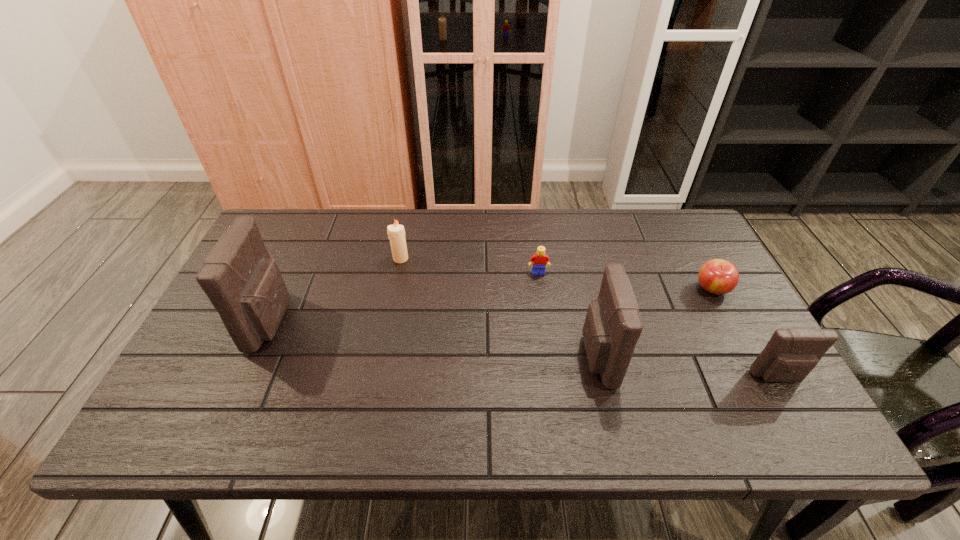
At what (x,y) coordinates should I click in order to perform the action: click on object that is positioned at the near right corner. Please return your answer as a coordinate pair (x, y). Looking at the image, I should click on (791, 354).

In the image, there is a desktop. Where is `vacant space at the far edge`? Image resolution: width=960 pixels, height=540 pixels. vacant space at the far edge is located at coordinates (538, 244).

I want to click on free space at the near edge of the desktop, so click(694, 393).

In the image, there is a desktop. Where is `vacant space at the left edge`? The height and width of the screenshot is (540, 960). vacant space at the left edge is located at coordinates (207, 366).

The width and height of the screenshot is (960, 540). Identify the location of free space at the right edge of the desktop. (696, 287).

Find the location of `blank area at the far right corner`. blank area at the far right corner is located at coordinates (676, 222).

Identify the location of vacant space at the near right corner of the desktop. The image size is (960, 540). (738, 396).

Identify the location of blank region between the farthest object and the leftmost pouch. (336, 290).

The height and width of the screenshot is (540, 960). What are the coordinates of `vacant space in between the apple and the farthest object` in the screenshot? It's located at (557, 274).

This screenshot has height=540, width=960. I want to click on blank region between the candle and the third object from left to right, so click(469, 266).